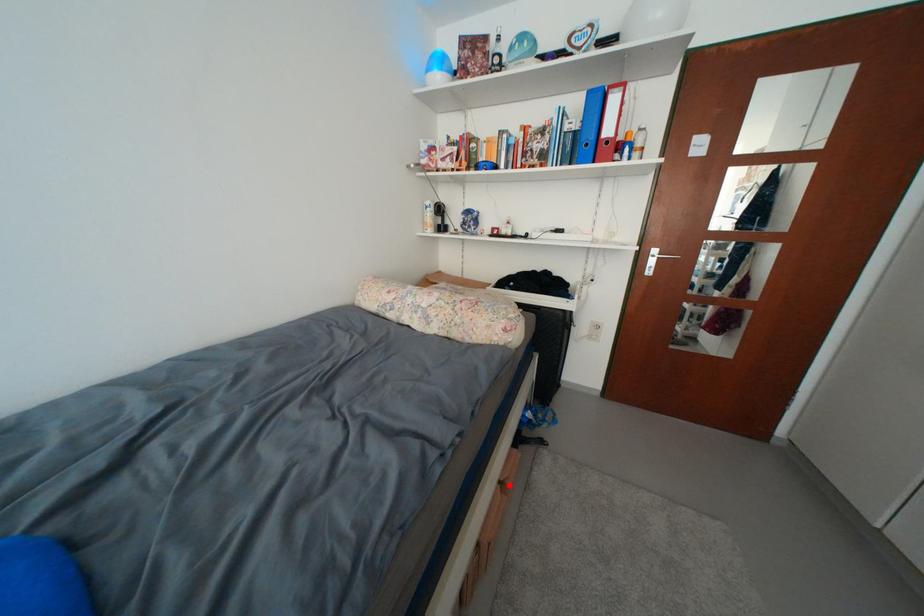
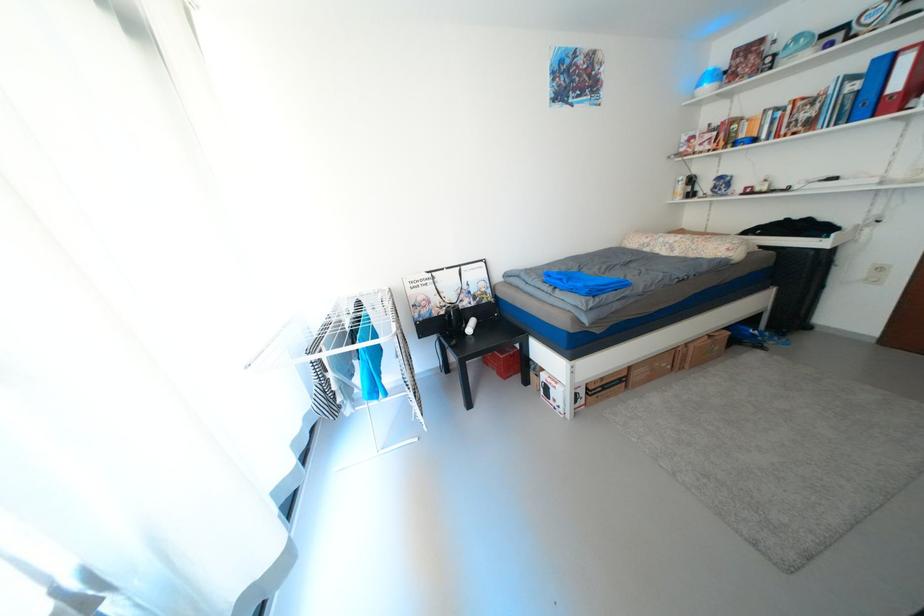
Question: I am providing you with two images of the same scene from different viewpoints. A red point is shown in image1. For the corresponding object point in image2, is it positioned nearer or farther from the camera?

Choices:
 (A) Nearer
 (B) Farther

Answer: (B)